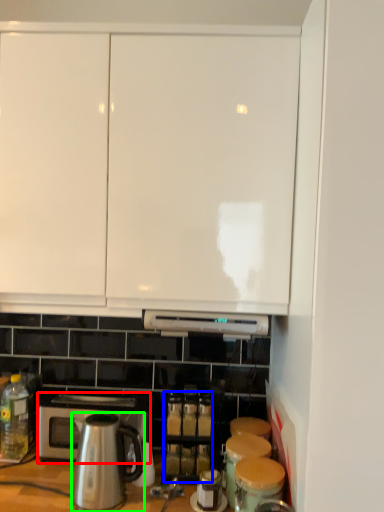
Question: Which is nearer to the microwave oven (highlighted by a red box)? beverage (highlighted by a blue box) or kitchen appliance (highlighted by a green box).

Choices:
 (A) beverage
 (B) kitchen appliance

Answer: (B)